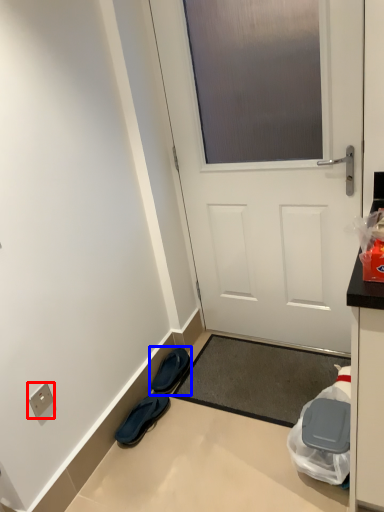
Question: Which object is closer to the camera taking this photo, electric outlet (highlighted by a red box) or footwear (highlighted by a blue box)?

Choices:
 (A) electric outlet
 (B) footwear

Answer: (A)